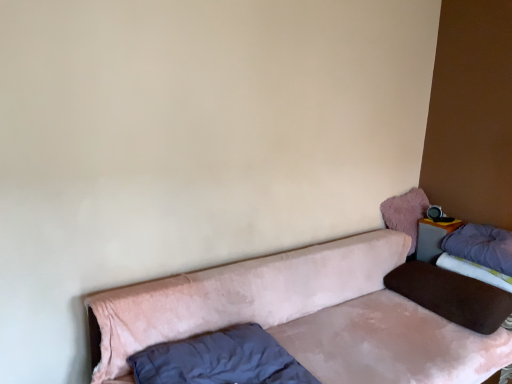
Locate an element on the screen. free space above matte gray table at upper right (from a real-world perspective) is located at coordinates (441, 219).